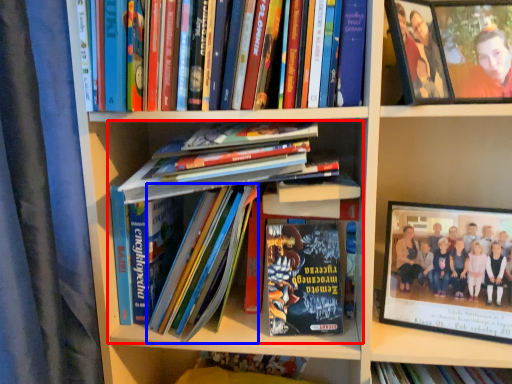
Question: Which of the following is the farthest to the observer, book (highlighted by a red box) or book (highlighted by a blue box)?

Choices:
 (A) book
 (B) book

Answer: (B)